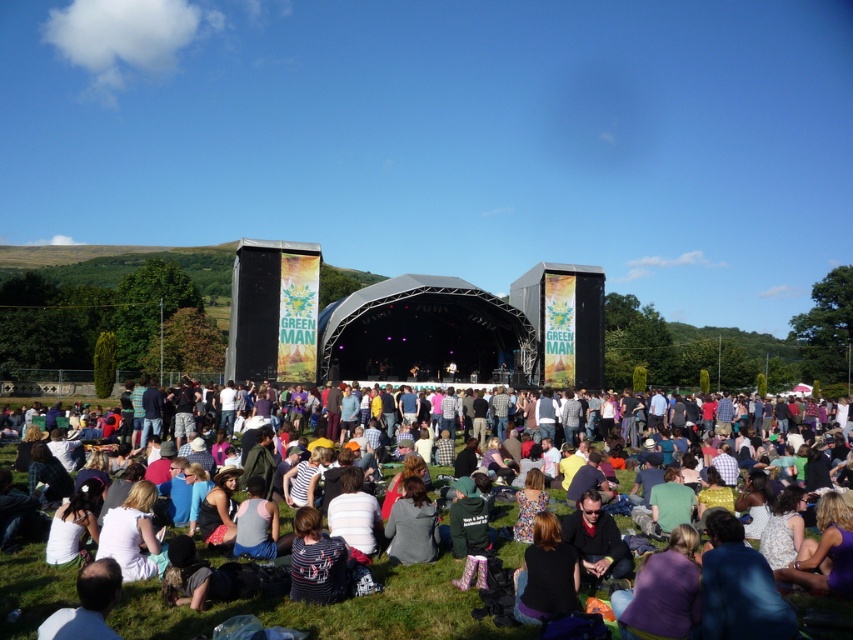
Which is more to the left, white cotton shirt at lower center or striped fabric shirt at lower center?

From the viewer's perspective, striped fabric shirt at lower center appears more on the left side.

Who is more distant from viewer, [18,602] or [294,596]?

The point [294,596] is more distant.

Where is `white cotton shirt at lower center`? This screenshot has width=853, height=640. white cotton shirt at lower center is located at coordinates pos(331,609).

Between black fabric jacket at lower center and dark gray sweater at center, which one is positioned higher?

Positioned higher is dark gray sweater at center.

Which of these two, black fabric jacket at lower center or dark gray sweater at center, stands taller?

black fabric jacket at lower center

What do you see at coordinates (544, 573) in the screenshot? I see `black fabric jacket at lower center` at bounding box center [544, 573].

Where is `black fabric jacket at lower center`? black fabric jacket at lower center is located at coordinates (544, 573).

Which is more to the right, black fabric jacket at lower center or striped fabric shirt at lower center?

Positioned to the right is black fabric jacket at lower center.

Is black fabric jacket at lower center smaller than striped fabric shirt at lower center?

Correct, black fabric jacket at lower center occupies less space than striped fabric shirt at lower center.

Identify the location of black fabric jacket at lower center. The width and height of the screenshot is (853, 640). (544, 573).